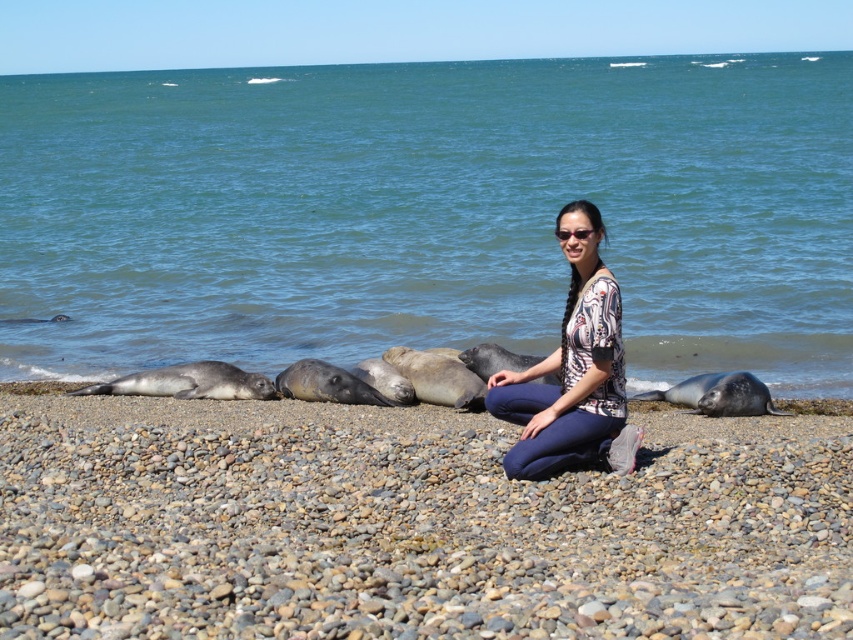
You are standing at the point labeled point (625, 339) and want to walk to the point labeled point (492, 531). Which direction should you move to reach your destination?

You should move forward because point (625, 339) is behind point (492, 531), so moving towards the front would get you there.

You are a photographer trying to capture the gray pebbled beach at center. Where should you position your camera to get the best shot?

The gray pebbled beach at center is located at point (409, 525), so you should position your camera at that coordinate to capture it best.